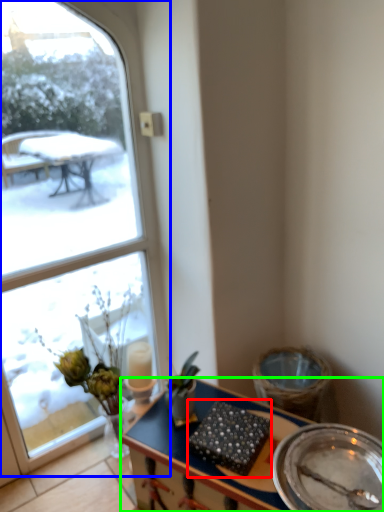
Question: Considering the real-world distances, which object is closest to food (highlighted by a red box)? window (highlighted by a blue box) or desk (highlighted by a green box).

Choices:
 (A) window
 (B) desk

Answer: (B)